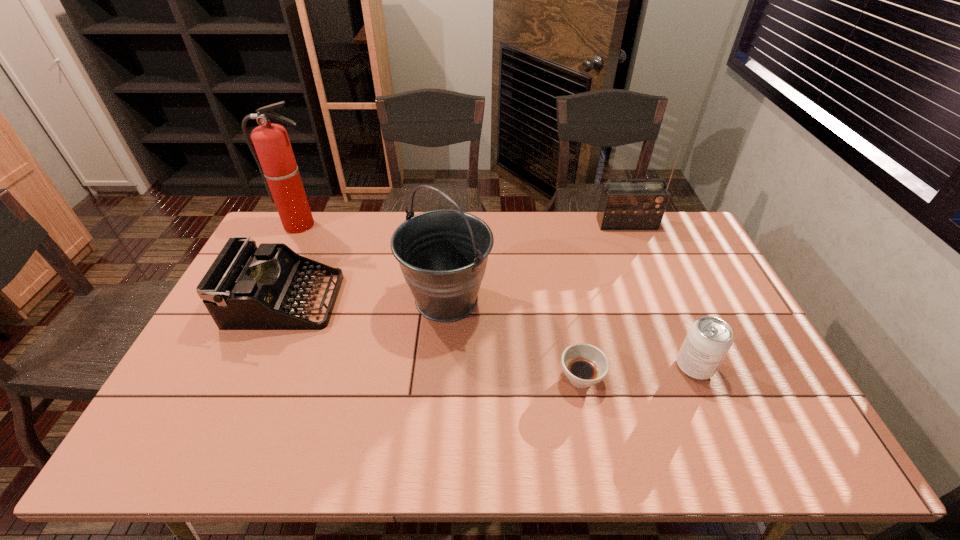
Find the location of a particular element. This screenshot has height=540, width=960. the tallest object is located at coordinates (274, 156).

Image resolution: width=960 pixels, height=540 pixels. What are the coordinates of `the fifth shortest object` in the screenshot? It's located at (443, 254).

Where is `the fourth object from right to left`? This screenshot has height=540, width=960. the fourth object from right to left is located at coordinates (443, 254).

Find the location of a particular element. the third tallest object is located at coordinates (623, 205).

Identify the location of typewriter. The width and height of the screenshot is (960, 540). (246, 288).

Where is `soda can`? Image resolution: width=960 pixels, height=540 pixels. soda can is located at coordinates (709, 339).

Locate an element on the screen. The width and height of the screenshot is (960, 540). the shortest object is located at coordinates (585, 365).

The width and height of the screenshot is (960, 540). Identify the location of the fourth object from left to right. (585, 365).

At what (x,y) coordinates should I click in order to perform the action: click on vacant space located with the nozzle and gauge on the tallest object. Please return your answer as a coordinate pair (x, y). This screenshot has height=540, width=960. Looking at the image, I should click on (280, 267).

Locate an element on the screen. The width and height of the screenshot is (960, 540). free space located 0.200m on the right of the fourth object from right to left is located at coordinates (557, 299).